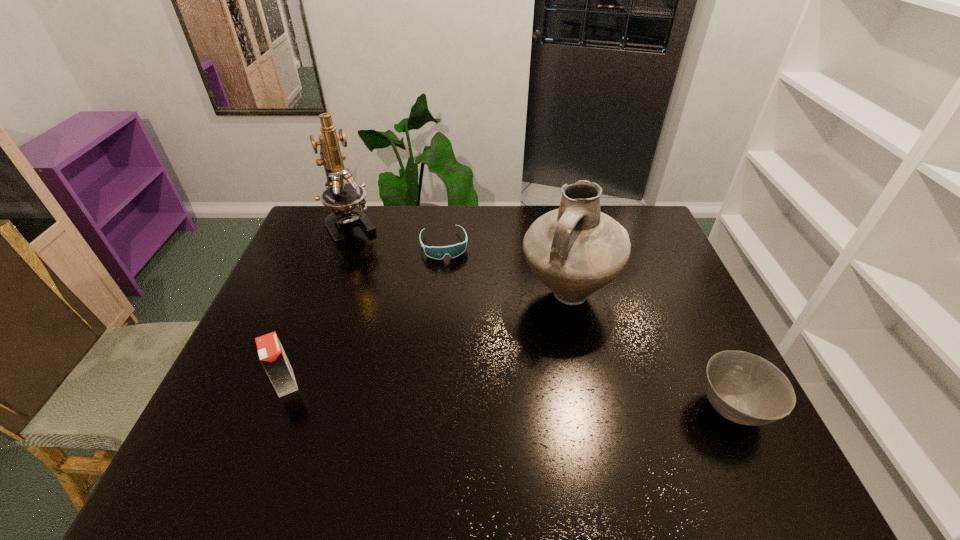
Locate an element on the screen. This screenshot has width=960, height=540. free space between the fourth tallest object and the orange juice is located at coordinates (510, 396).

Where is `free spot between the second shortest object and the microscope`? free spot between the second shortest object and the microscope is located at coordinates (542, 317).

In order to click on vacant space that's between the rightmost object and the third farthest object in this screenshot , I will do `click(650, 351)`.

Select which object appears as the closest to the pitcher. Please provide its 2D coordinates. Your answer should be formatted as a tuple, i.e. [(x, y)], where the tuple contains the x and y coordinates of a point satisfying the conditions above.

[(453, 251)]

Locate which object ranks fourth in proximity to the orange juice. Please provide its 2D coordinates. Your answer should be formatted as a tuple, i.e. [(x, y)], where the tuple contains the x and y coordinates of a point satisfying the conditions above.

[(744, 388)]

Locate an element on the screen. The image size is (960, 540). vacant point that satisfies the following two spatial constraints: 1. on the front side of the pitcher; 2. on the left side of the bowl is located at coordinates (591, 408).

What are the coordinates of `blank area in the image that satisfies the following two spatial constraints: 1. on the back side of the orange juice; 2. on the right side of the third object from left to right` in the screenshot? It's located at (339, 245).

Where is `vacant area that satisfies the following two spatial constraints: 1. on the front side of the third object from left to right; 2. on the left side of the microscope`? The width and height of the screenshot is (960, 540). vacant area that satisfies the following two spatial constraints: 1. on the front side of the third object from left to right; 2. on the left side of the microscope is located at coordinates (345, 245).